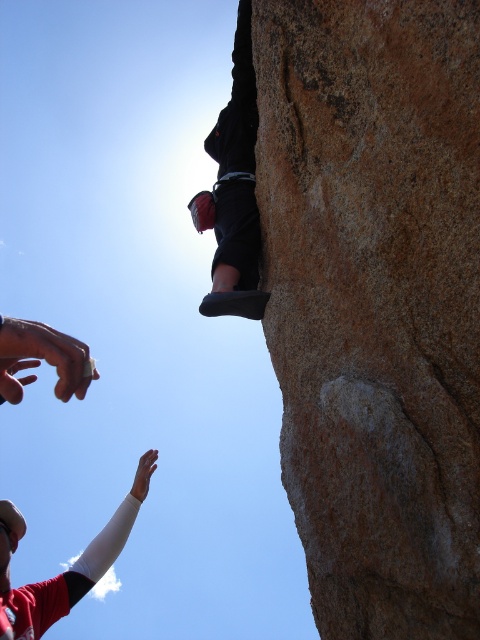
You are a climber assessing the rock face. You see the brown rough rock at upper right and the black fabric climbing harness at upper center. Which object is positioned to the right side of the other?

The brown rough rock at upper right is positioned to the right of the black fabric climbing harness at upper center.

You are a climber assessing the route. You see the brown rough rock at upper right and the black fabric climbing harness at upper center. Which object is located lower in the image?

The brown rough rock at upper right is positioned under the black fabric climbing harness at upper center, so it is lower in the image.

You are a climber trying to reach a specific point on the rock face. The coordinates given are point (374, 301). Based on the scene description, what kind of surface will you encounter at that point?

The point (374, 301) corresponds to brown rough rock at upper right, which has a rugged and uneven texture.